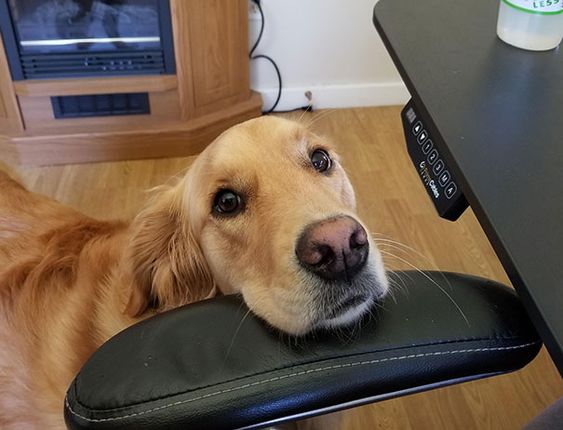
Locate an element on the screen. desk is located at coordinates (500, 117).